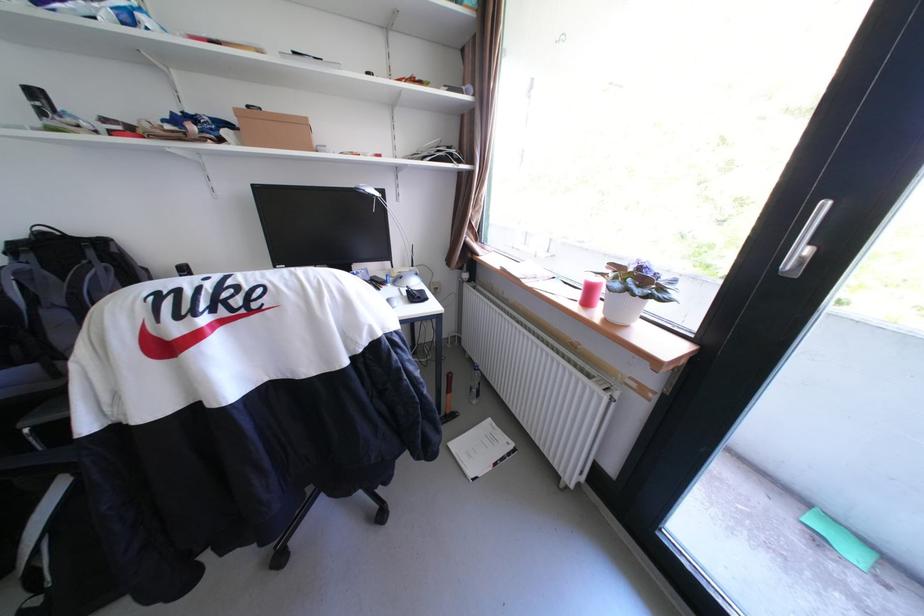
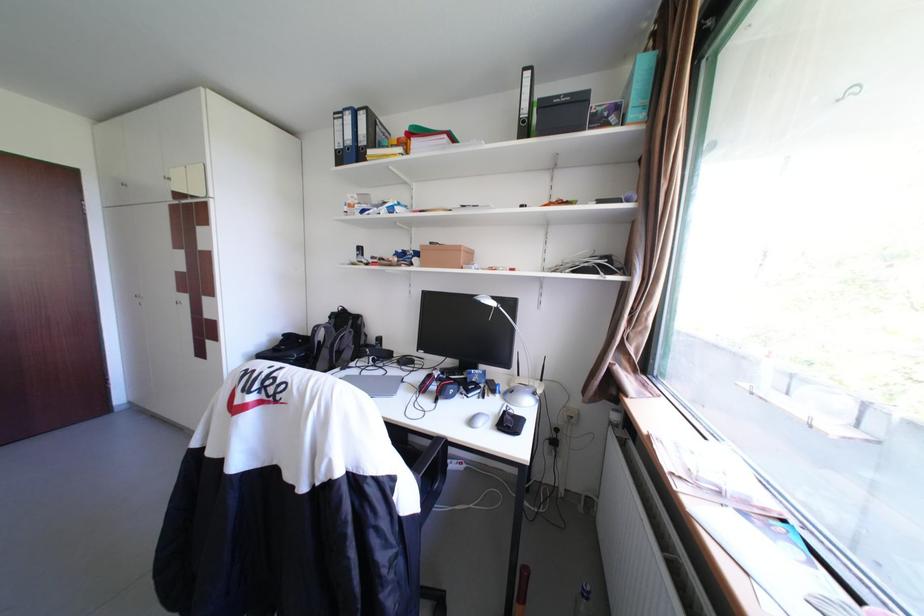
Find the pixel in the second image that matches [247,111] in the first image.

(432, 246)